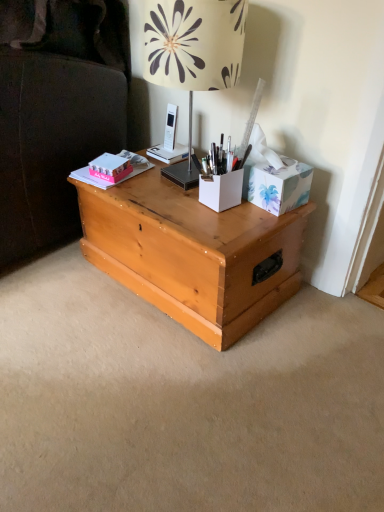
What do you see at coordinates (135, 163) in the screenshot? The height and width of the screenshot is (512, 384). I see `pink matte book at upper left` at bounding box center [135, 163].

What do you see at coordinates (193, 253) in the screenshot?
I see `light wood trunk at center` at bounding box center [193, 253].

Where is `beige floral lampshade at upper center`? Image resolution: width=384 pixels, height=512 pixels. beige floral lampshade at upper center is located at coordinates (193, 55).

What do you see at coordinates (193, 55) in the screenshot? The height and width of the screenshot is (512, 384). I see `beige floral lampshade at upper center` at bounding box center [193, 55].

Describe the element at coordinates (277, 185) in the screenshot. The height and width of the screenshot is (512, 384). I see `floral-patterned cardboard tissue box at upper right, marked as the second cardboard box in a left-to-right arrangement` at that location.

In order to click on white matte pen holder at center, the first cardboard box in the left-to-right sequence in this screenshot , I will do `click(221, 190)`.

This screenshot has height=512, width=384. Describe the element at coordinates (110, 167) in the screenshot. I see `pink matte box at upper left` at that location.

Find the location of a particular element. pink matte book at upper left is located at coordinates (135, 163).

Considering the sizes of objects floral-patterned cardboard tissue box at upper right, the first cardboard box positioned from the right, and pink matte book at upper left in the image provided, who is bigger, floral-patterned cardboard tissue box at upper right, the first cardboard box positioned from the right, or pink matte book at upper left?

With larger size is floral-patterned cardboard tissue box at upper right, the first cardboard box positioned from the right.

Would you consider floral-patterned cardboard tissue box at upper right, marked as the second cardboard box in a left-to-right arrangement, to be distant from pink matte book at upper left?

No, floral-patterned cardboard tissue box at upper right, marked as the second cardboard box in a left-to-right arrangement, is not far from pink matte book at upper left.

Which point is more distant from viewer, (260, 196) or (115, 184)?

The point (115, 184) is farther.

Can you tell me how much floral-patterned cardboard tissue box at upper right, marked as the second cardboard box in a left-to-right arrangement, and pink matte book at upper left differ in facing direction?

14.8 degrees.

In terms of width, does beige floral lampshade at upper center look wider or thinner when compared to floral-patterned cardboard tissue box at upper right, marked as the second cardboard box in a left-to-right arrangement?

beige floral lampshade at upper center is wider than floral-patterned cardboard tissue box at upper right, marked as the second cardboard box in a left-to-right arrangement.

Can floral-patterned cardboard tissue box at upper right, marked as the second cardboard box in a left-to-right arrangement, be found inside beige floral lampshade at upper center?

No, beige floral lampshade at upper center does not contain floral-patterned cardboard tissue box at upper right, marked as the second cardboard box in a left-to-right arrangement.

The image size is (384, 512). Find the location of `lamp on the left of floral-patterned cardboard tissue box at upper right, the first cardboard box positioned from the right`. lamp on the left of floral-patterned cardboard tissue box at upper right, the first cardboard box positioned from the right is located at coordinates (193, 55).

Are pink matte box at upper left and light wood trunk at center far apart?

That's not correct — pink matte box at upper left is a little close to light wood trunk at center.

Considering the sizes of objects pink matte box at upper left and light wood trunk at center in the image provided, who is shorter, pink matte box at upper left or light wood trunk at center?

Standing shorter between the two is pink matte box at upper left.

From the image's perspective, is pink matte box at upper left under light wood trunk at center?

No.

Is pink matte box at upper left completely or partially outside of light wood trunk at center?

Absolutely, pink matte box at upper left is external to light wood trunk at center.

Does floral-patterned cardboard tissue box at upper right, marked as the second cardboard box in a left-to-right arrangement, turn towards pink matte box at upper left?

No, floral-patterned cardboard tissue box at upper right, marked as the second cardboard box in a left-to-right arrangement, does not turn towards pink matte box at upper left.

From a real-world perspective, between floral-patterned cardboard tissue box at upper right, marked as the second cardboard box in a left-to-right arrangement, and pink matte box at upper left, who is vertically higher?

floral-patterned cardboard tissue box at upper right, marked as the second cardboard box in a left-to-right arrangement, from a real-world perspective.

Does floral-patterned cardboard tissue box at upper right, marked as the second cardboard box in a left-to-right arrangement, have a greater width compared to pink matte box at upper left?

No.

Could pink matte box at upper left be considered to be inside floral-patterned cardboard tissue box at upper right, marked as the second cardboard box in a left-to-right arrangement?

No, pink matte box at upper left is located outside of floral-patterned cardboard tissue box at upper right, marked as the second cardboard box in a left-to-right arrangement.

Based on the photo, would you say pink matte book at upper left is a long distance from pink matte box at upper left?

Actually, pink matte book at upper left and pink matte box at upper left are a little close together.

Who is smaller, pink matte book at upper left or pink matte box at upper left?

With smaller size is pink matte box at upper left.

Is point (145, 167) in front of point (99, 174)?

No, (145, 167) is behind (99, 174).

From a real-world perspective, which is physically above, pink matte book at upper left or pink matte box at upper left?

pink matte box at upper left.

Locate an element on the screen. This screenshot has height=512, width=384. desk directly beneath the beige floral lampshade at upper center (from a real-world perspective) is located at coordinates (193, 253).

From a real-world perspective, who is located higher, beige floral lampshade at upper center or light wood trunk at center?

From a 3D spatial view, beige floral lampshade at upper center is above.

How many degrees apart are the facing directions of beige floral lampshade at upper center and light wood trunk at center?

The facing directions of beige floral lampshade at upper center and light wood trunk at center are 4.94 degrees apart.

Considering the relative positions of beige floral lampshade at upper center and light wood trunk at center in the image provided, is beige floral lampshade at upper center in front of light wood trunk at center?

That is True.

Find the location of a particular element. The image size is (384, 512). lamp on the left of the floral-patterned cardboard tissue box at upper right, the first cardboard box positioned from the right is located at coordinates (193, 55).

Which is further, (x=286, y=185) or (x=163, y=24)?

The point (x=286, y=185) is farther from the camera.

In terms of height, does floral-patterned cardboard tissue box at upper right, marked as the second cardboard box in a left-to-right arrangement, look taller or shorter compared to beige floral lampshade at upper center?

floral-patterned cardboard tissue box at upper right, marked as the second cardboard box in a left-to-right arrangement, is shorter than beige floral lampshade at upper center.

Does floral-patterned cardboard tissue box at upper right, marked as the second cardboard box in a left-to-right arrangement, have a smaller size compared to beige floral lampshade at upper center?

Yes.

The width and height of the screenshot is (384, 512). What are the coordinates of `book that appears below the floral-patterned cardboard tissue box at upper right, marked as the second cardboard box in a left-to-right arrangement (from a real-world perspective)` in the screenshot? It's located at (135, 163).

At what (x,y) coordinates should I click in order to perform the action: click on lamp located in front of the floral-patterned cardboard tissue box at upper right, marked as the second cardboard box in a left-to-right arrangement. Please return your answer as a coordinate pair (x, y). The image size is (384, 512). Looking at the image, I should click on (193, 55).

Based on their spatial positions, is light wood trunk at center or pink matte book at upper left further from beige floral lampshade at upper center?

light wood trunk at center is positioned further to the anchor beige floral lampshade at upper center.

Based on the photo, from the image, which object appears to be farther from light wood trunk at center, floral-patterned cardboard tissue box at upper right, marked as the second cardboard box in a left-to-right arrangement, or beige floral lampshade at upper center?

beige floral lampshade at upper center is positioned further to the anchor light wood trunk at center.

From the image, which object appears to be nearer to white matte pen holder at center, the first cardboard box in the left-to-right sequence, floral-patterned cardboard tissue box at upper right, marked as the second cardboard box in a left-to-right arrangement, or light wood trunk at center?

floral-patterned cardboard tissue box at upper right, marked as the second cardboard box in a left-to-right arrangement, is closer to white matte pen holder at center, the first cardboard box in the left-to-right sequence.

Which object lies further to the anchor point beige floral lampshade at upper center, pink matte box at upper left or pink matte book at upper left?

pink matte book at upper left lies further to beige floral lampshade at upper center than the other object.

Looking at the image, which one is located further to pink matte book at upper left, floral-patterned cardboard tissue box at upper right, the first cardboard box positioned from the right, or beige floral lampshade at upper center?

The object further to pink matte book at upper left is floral-patterned cardboard tissue box at upper right, the first cardboard box positioned from the right.

From the image, which object appears to be farther from white matte pen holder at center, marked as the 2th cardboard box in a right-to-left arrangement, pink matte box at upper left or pink matte book at upper left?

Among the two, pink matte book at upper left is located further to white matte pen holder at center, marked as the 2th cardboard box in a right-to-left arrangement.

Which object lies further to the anchor point beige floral lampshade at upper center, white matte pen holder at center, marked as the 2th cardboard box in a right-to-left arrangement, or pink matte box at upper left?

The object further to beige floral lampshade at upper center is pink matte box at upper left.

Considering their positions, is floral-patterned cardboard tissue box at upper right, the first cardboard box positioned from the right, positioned further to pink matte book at upper left than pink matte box at upper left?

floral-patterned cardboard tissue box at upper right, the first cardboard box positioned from the right, lies further to pink matte book at upper left than the other object.

Find the location of a particular element. The image size is (384, 512). cardboard box between light wood trunk at center and floral-patterned cardboard tissue box at upper right, the first cardboard box positioned from the right, in the horizontal direction is located at coordinates (221, 190).

Where is `lamp between pink matte box at upper left and floral-patterned cardboard tissue box at upper right, marked as the second cardboard box in a left-to-right arrangement`? The height and width of the screenshot is (512, 384). lamp between pink matte box at upper left and floral-patterned cardboard tissue box at upper right, marked as the second cardboard box in a left-to-right arrangement is located at coordinates (193, 55).

The image size is (384, 512). What are the coordinates of `lamp between pink matte book at upper left and floral-patterned cardboard tissue box at upper right, marked as the second cardboard box in a left-to-right arrangement, in the horizontal direction` in the screenshot? It's located at (193, 55).

Find the location of `box between beige floral lampshade at upper center and light wood trunk at center vertically`. box between beige floral lampshade at upper center and light wood trunk at center vertically is located at coordinates (110, 167).